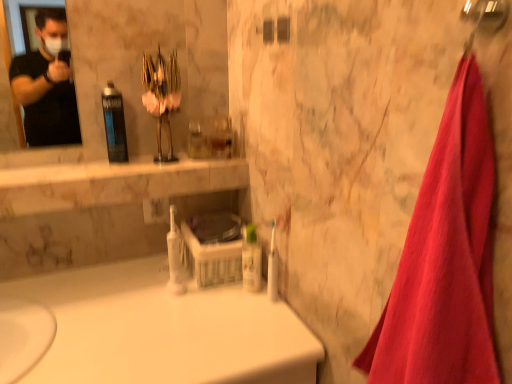
This screenshot has height=384, width=512. I want to click on free space above white glossy bathtub at center (from a real-world perspective), so click(x=159, y=323).